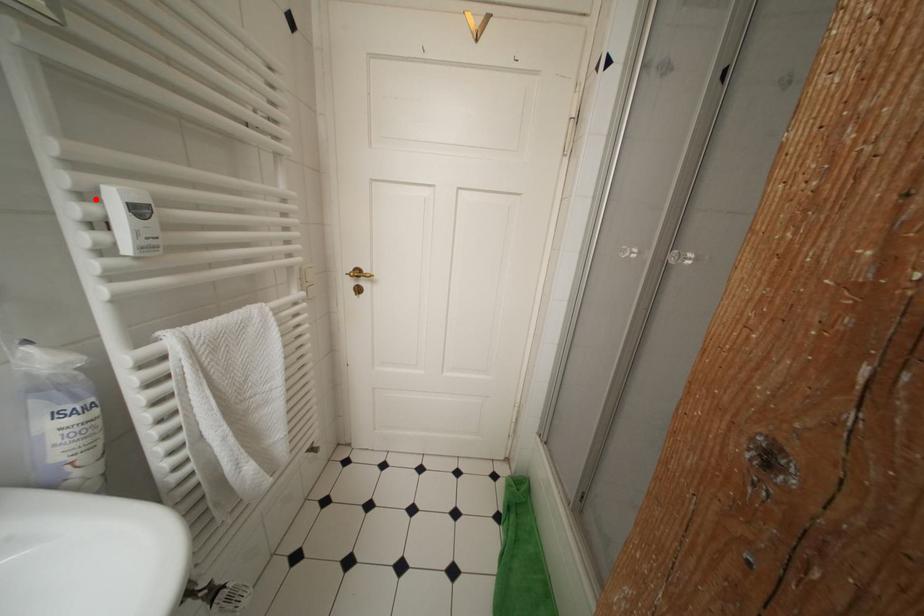
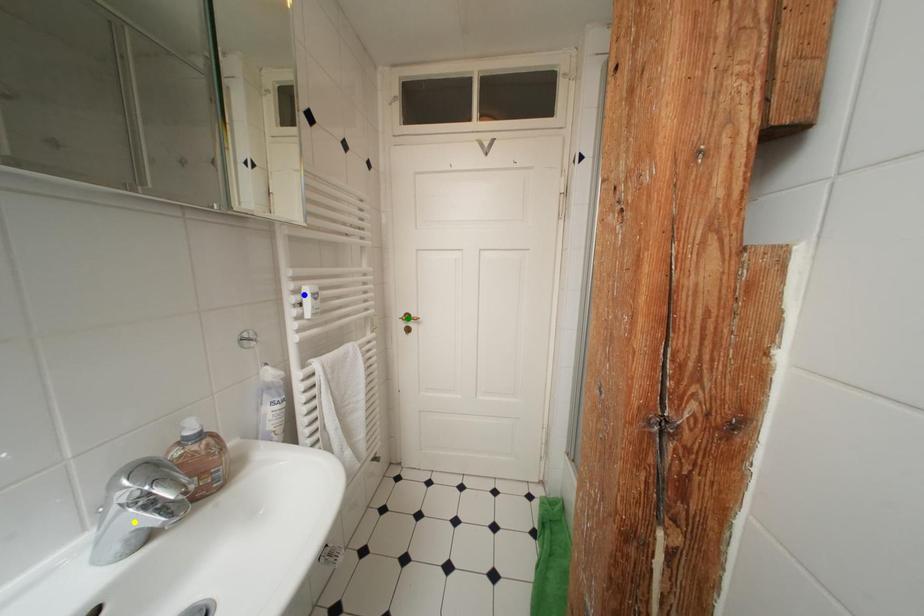
Question: I am providing you with two images of the same scene from different viewpoints. A red point is marked on the first image. You are given multiple points on the second image. Which point in image 2 is actually the same real-world point as the red point in image 1?

Choices:
 (A) yellow point
 (B) blue point
 (C) green point

Answer: (B)